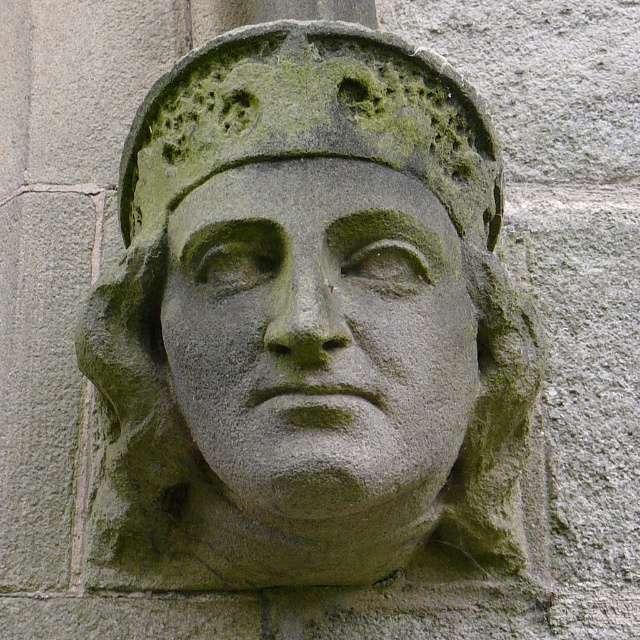
You are an archaeologist examining the stone carving. You notice two parts of the carving labeled as the green stone head at center and the green stone face at center. Which part has a greater width?

The green stone head at center has a greater width than the green stone face at center.